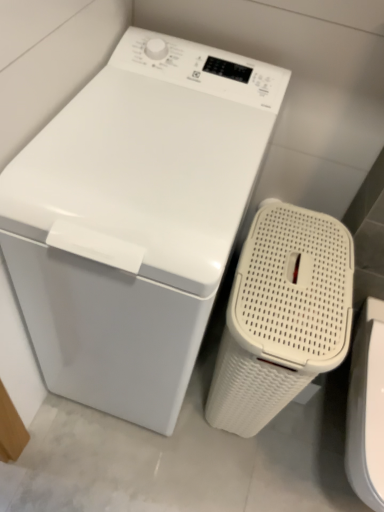
This screenshot has width=384, height=512. I want to click on free point below white woven laundry basket at right (from a real-world perspective), so click(x=332, y=451).